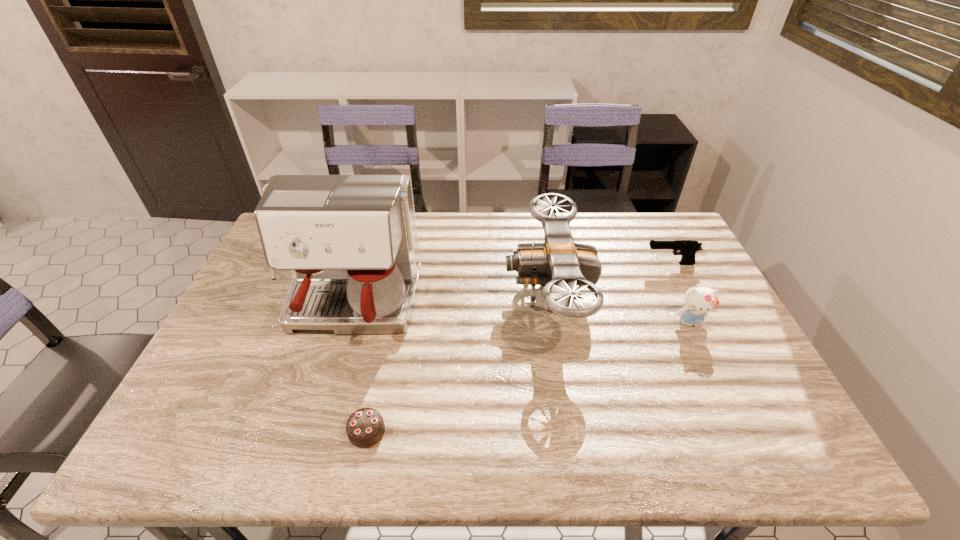
Identify the location of coffee maker. (350, 241).

Image resolution: width=960 pixels, height=540 pixels. I want to click on the third object from right to left, so click(559, 264).

This screenshot has width=960, height=540. Find the location of `the fourth shortest object`. the fourth shortest object is located at coordinates 559,264.

Identify the location of the third tallest object. The image size is (960, 540). (699, 300).

The image size is (960, 540). I want to click on pistol, so click(688, 248).

This screenshot has width=960, height=540. I want to click on the shortest object, so click(x=365, y=427).

The height and width of the screenshot is (540, 960). In order to click on the nearest object in this screenshot , I will do `click(365, 427)`.

This screenshot has height=540, width=960. I want to click on vacant area situated 0.180m on the front of the tallest object near the spout, so click(318, 417).

This screenshot has height=540, width=960. I want to click on vacant area situated 0.380m on the front-facing side of the drone, so click(x=379, y=294).

Where is `free region located 0.110m on the front-facing side of the drone`? free region located 0.110m on the front-facing side of the drone is located at coordinates (468, 294).